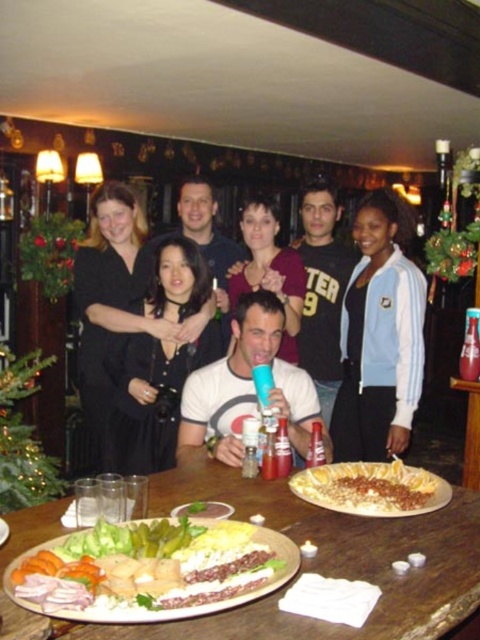
You are a photographer taking a photo of the group. You notice the blue and white jacket at center and the matte plastic cup at center. Which object is closer to the camera?

The blue and white jacket at center is closer to the camera because the matte plastic cup at center is behind it.